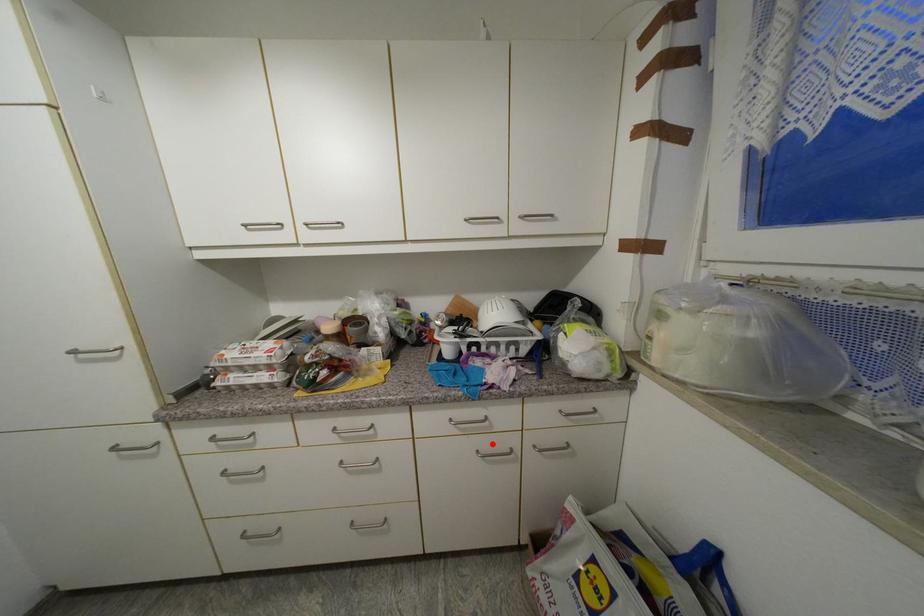
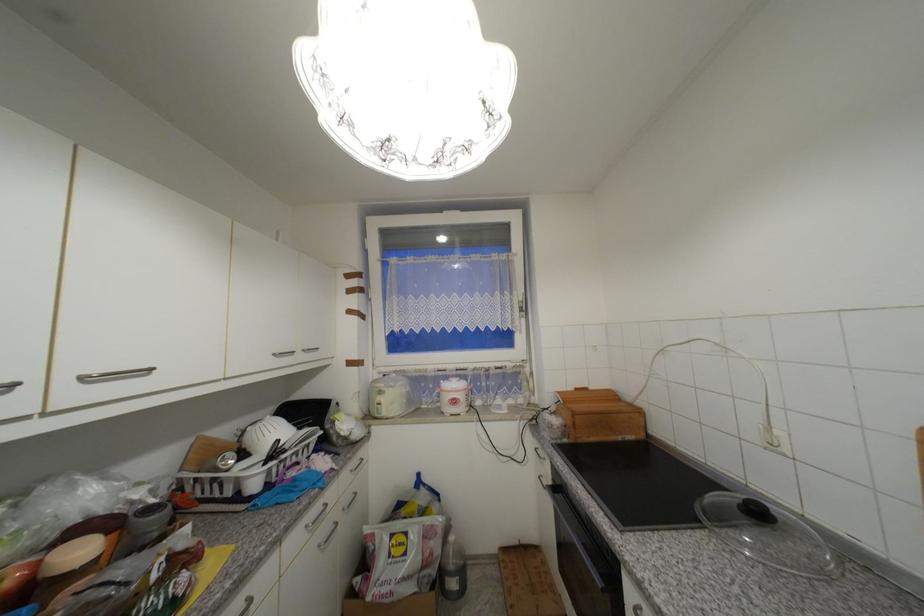
Question: I am providing you with two images of the same scene from different viewpoints. Given a red point in image1, look at the same physical point in image2. Is it:

Choices:
 (A) Closer to the viewpoint
 (B) Farther from the viewpoint

Answer: (A)